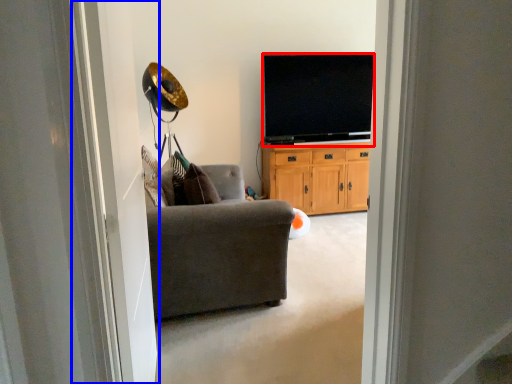
Question: Which of the following is the farthest to the observer, television (highlighted by a red box) or screen door (highlighted by a blue box)?

Choices:
 (A) television
 (B) screen door

Answer: (A)